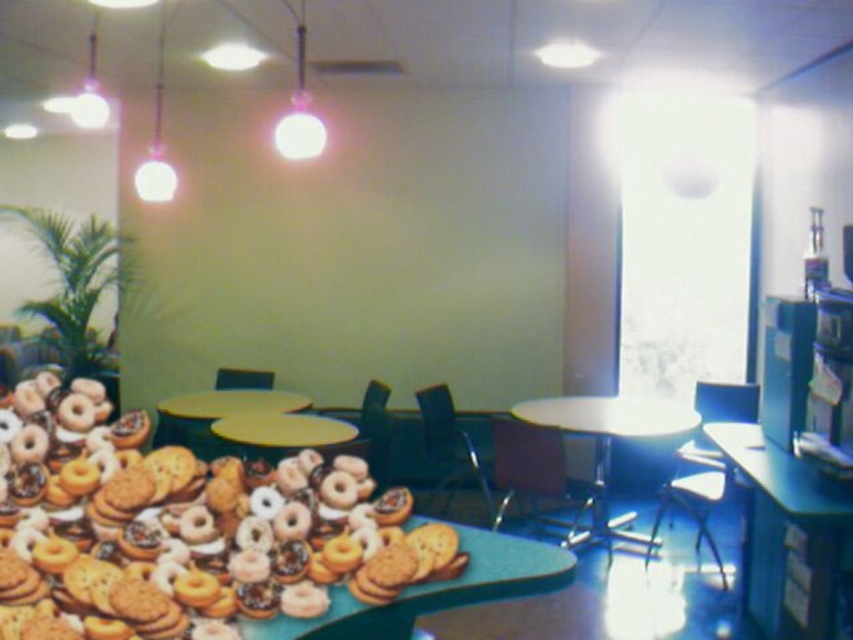
Which of these two, metallic blue table at lower right or yellow plastic table at center, stands taller?

metallic blue table at lower right is taller.

Is metallic blue table at lower right further to the viewer compared to yellow plastic table at center?

No, metallic blue table at lower right is in front of yellow plastic table at center.

Is point (807, 602) closer to camera compared to point (279, 396)?

Yes.

Image resolution: width=853 pixels, height=640 pixels. Find the location of `metallic blue table at lower right`. metallic blue table at lower right is located at coordinates (784, 531).

Which of these two, white glossy table at center or yellow matte table at center, stands taller?

With more height is white glossy table at center.

Is point (529, 401) closer to viewer compared to point (328, 433)?

No, (529, 401) is behind (328, 433).

Locate an element on the screen. This screenshot has width=853, height=640. white glossy table at center is located at coordinates (608, 448).

Does point (805, 621) come behind point (576, 545)?

No, it is in front of (576, 545).

Looking at this image, who is more distant from viewer, [769,481] or [608,449]?

The point [608,449] is more distant.

Between point (770, 616) and point (689, 417), which one is positioned behind?

Point (689, 417)

Identify the location of metallic blue table at lower right. (784, 531).